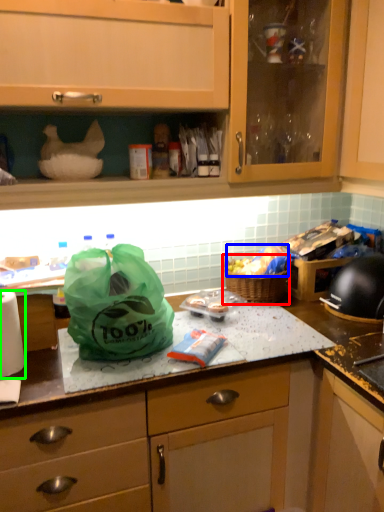
Question: Which is farther away from picnic basket (highlighted by a red box)? food (highlighted by a blue box) or paper towel (highlighted by a green box)?

Choices:
 (A) food
 (B) paper towel

Answer: (B)